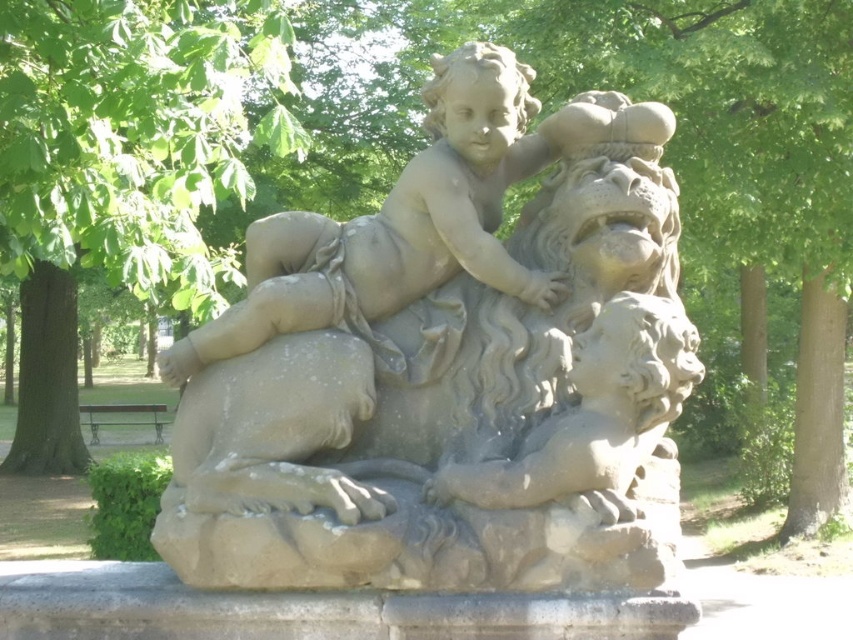
You are standing in front of the gray stone statue at center and want to take a photo of it with the green leafy tree at upper left in the background. Will the tree be visible behind the statue in your photo?

The gray stone statue at center is closer to the viewer than the green leafy tree at upper left, so the tree will be visible behind the statue in the photo.

You are standing in front of the sculpture and want to take a photo that includes both the gray stone statue at center and the green leafy tree at upper left. Which object should you position closer to the left side of your camera frame?

The green leafy tree at upper left should be positioned closer to the left side of your camera frame because the gray stone statue at center is to the right of it.